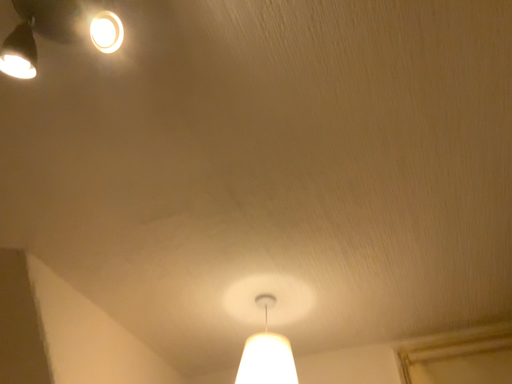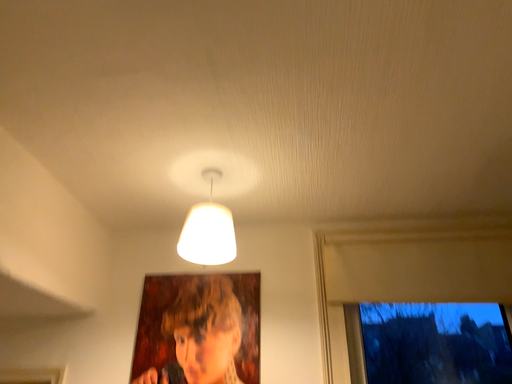
Question: How did the camera likely rotate when shooting the video?

Choices:
 (A) rotated downward
 (B) rotated upward

Answer: (A)